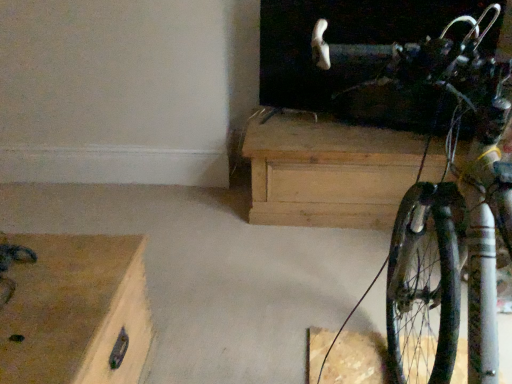
Image resolution: width=512 pixels, height=384 pixels. I want to click on vacant region in front of natural wood chest at center, which is the first chest of drawers in back-to-front order, so click(298, 268).